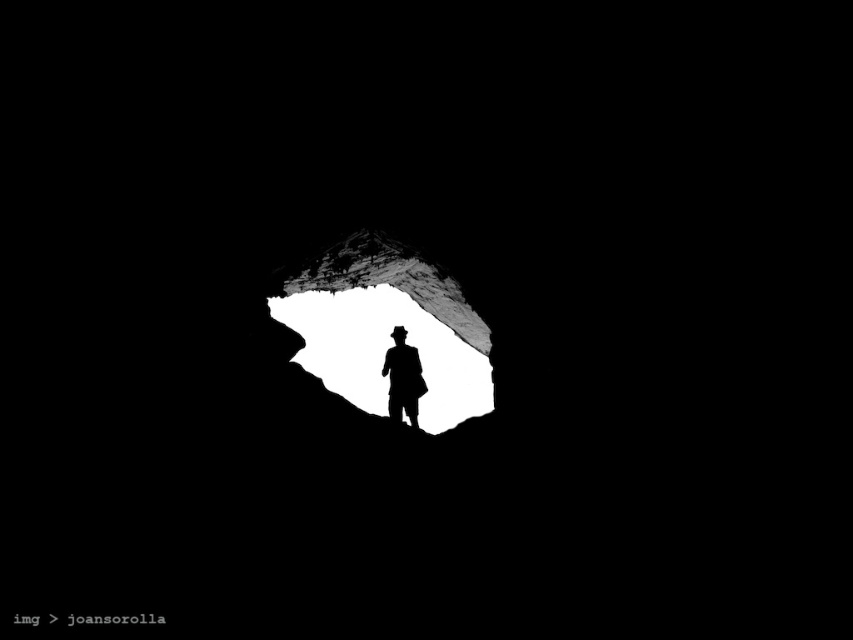
Looking at this image, is white matte cave at center to the left of black matte silhouette at center from the viewer's perspective?

Indeed, white matte cave at center is positioned on the left side of black matte silhouette at center.

Is point (340, 364) farther from camera compared to point (421, 392)?

Yes, point (340, 364) is farther from viewer.

Does point (309, 336) lie in front of point (392, 349)?

No.

Where is `white matte cave at center`? This screenshot has width=853, height=640. white matte cave at center is located at coordinates (386, 326).